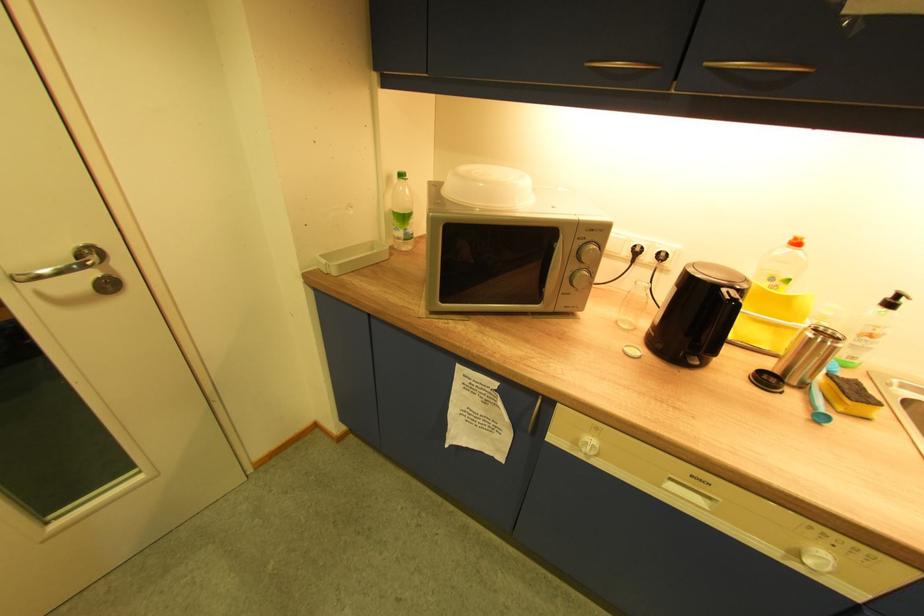
The height and width of the screenshot is (616, 924). What are the coordinates of `kettle lid button` in the screenshot? It's located at (732, 296).